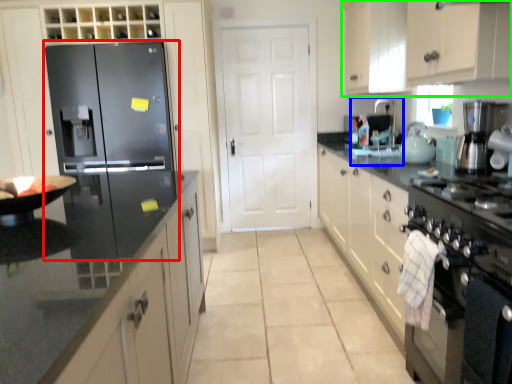
Question: Which object is positioned farthest from refrigerator (highlighted by a red box)? Select from sink (highlighted by a blue box) and cabinetry (highlighted by a green box).

Choices:
 (A) sink
 (B) cabinetry

Answer: (B)